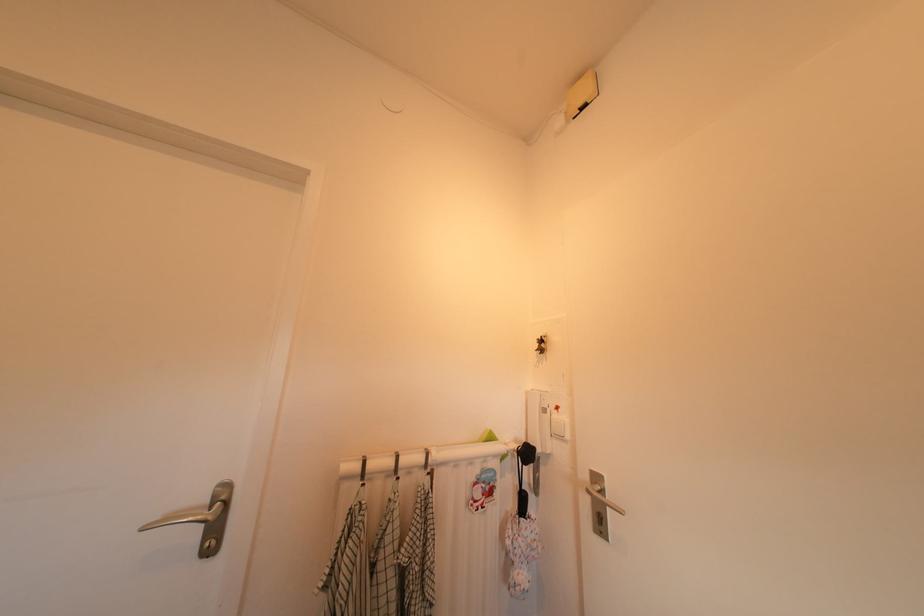
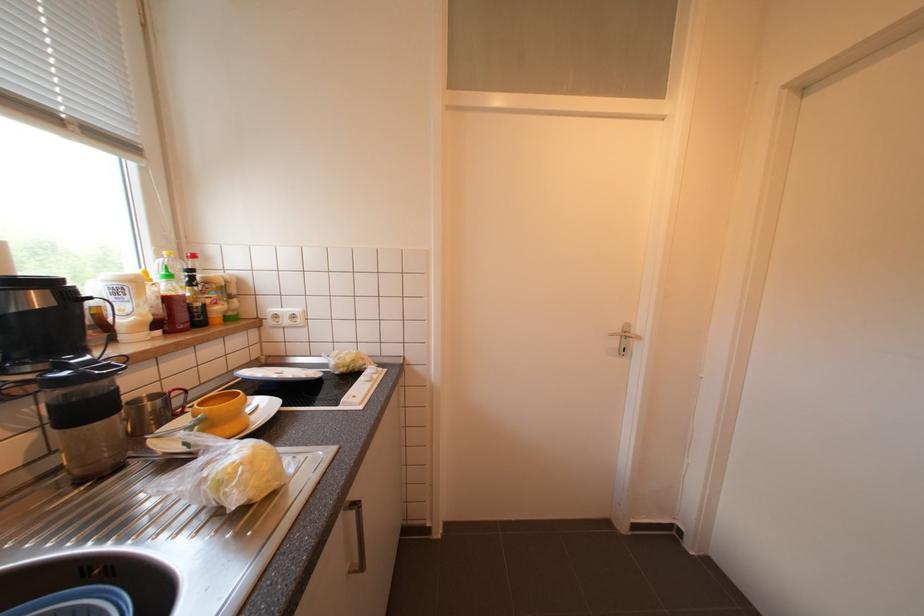
Question: The camera is either moving clockwise (left) or counter-clockwise (right) around the object. The first image is from the beginning of the video and the second image is from the end. Is the camera moving left or right when shooting the video?

Choices:
 (A) Left
 (B) Right

Answer: (B)